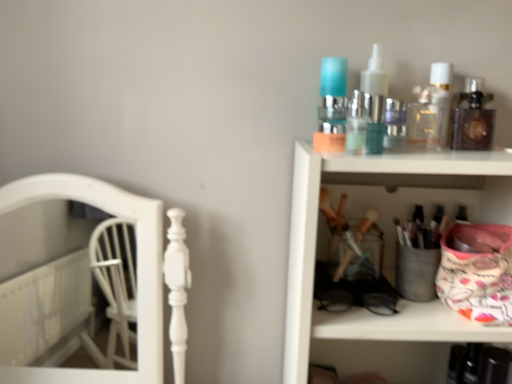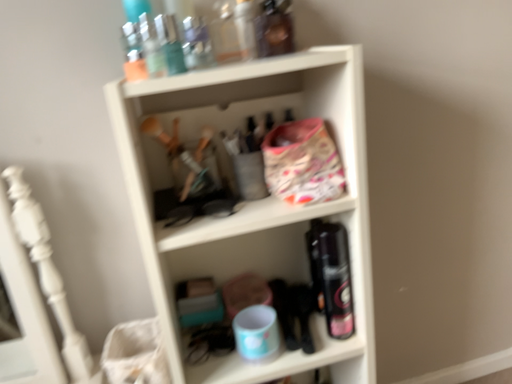
Question: Which way did the camera rotate in the video?

Choices:
 (A) rotated right
 (B) rotated left

Answer: (A)